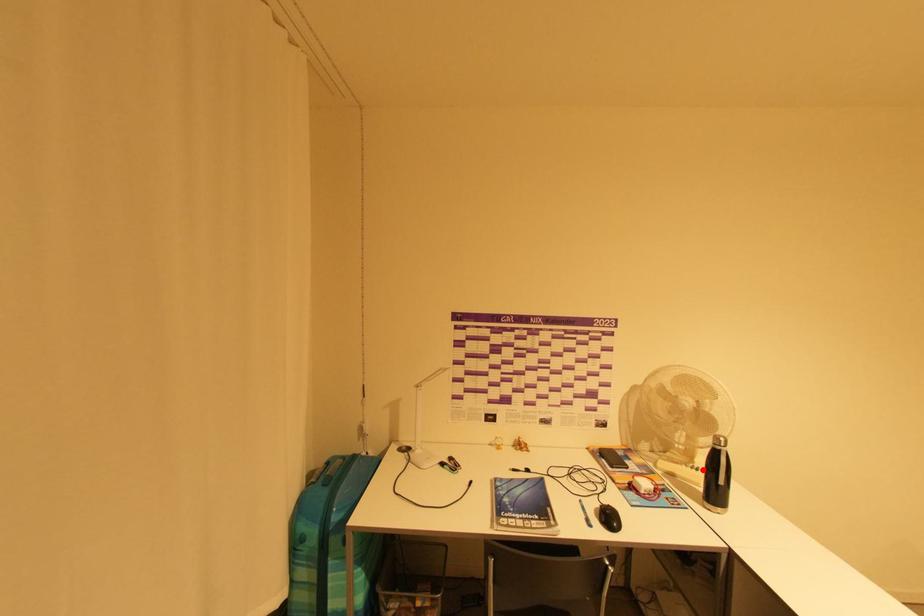
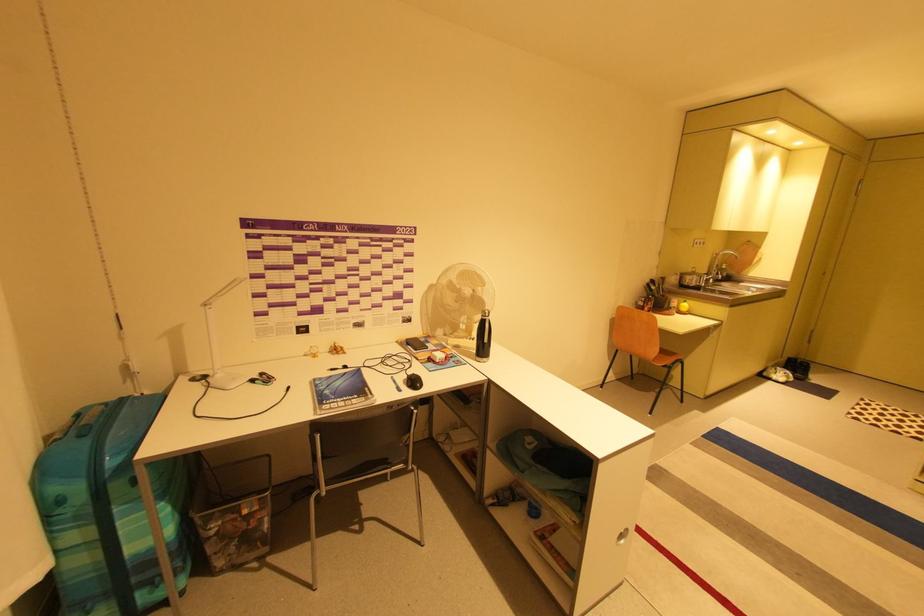
Where in the second image is the point corresponding to the highlighted location from the first image?

(479, 339)